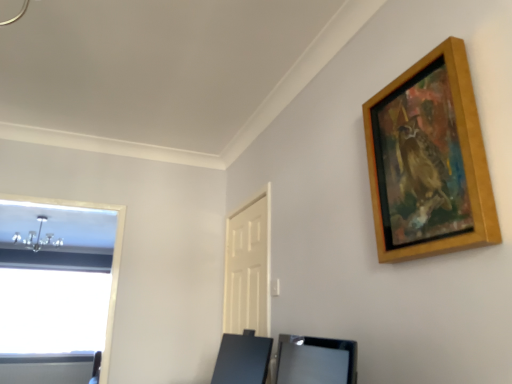
Question: Choose the correct answer: Is satin black vanity at lower center, arranged as the second vanity when viewed from the back, inside white matte door at center or outside it?

Choices:
 (A) inside
 (B) outside

Answer: (B)

Question: In the image, is satin black vanity at lower center, which is the first vanity in front-to-back order, positioned in front of or behind white matte door at center?

Choices:
 (A) behind
 (B) front

Answer: (B)

Question: Estimate the real-world distances between objects in this image. Which object is closer to the black glossy vanity at lower center, the 1th vanity viewed from the back?

Choices:
 (A) white matte door at center
 (B) satin black vanity at lower center, arranged as the second vanity when viewed from the back
 (C) wooden picture frame at upper right

Answer: (B)

Question: Which of these objects is positioned closest to the black glossy vanity at lower center, the 1th vanity viewed from the back?

Choices:
 (A) wooden picture frame at upper right
 (B) satin black vanity at lower center, arranged as the second vanity when viewed from the back
 (C) white matte door at center

Answer: (B)